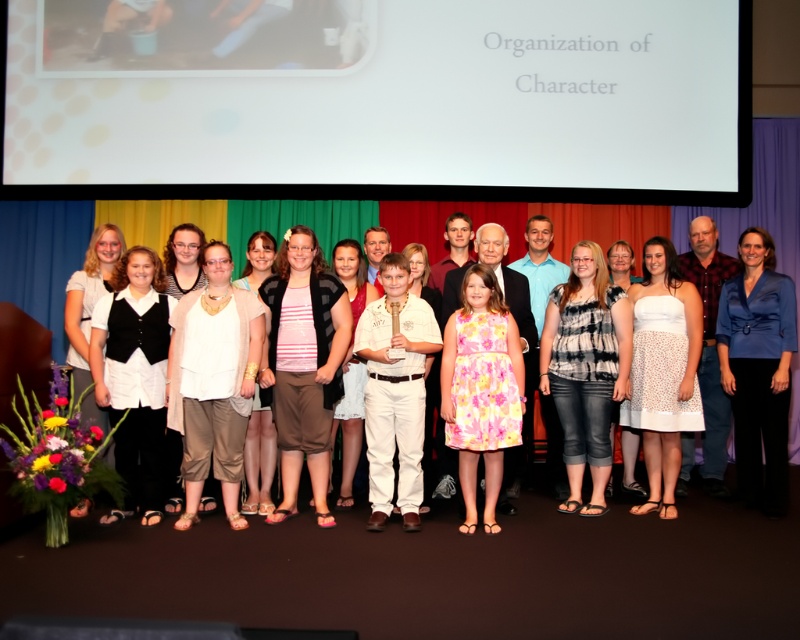
From the picture: Can you confirm if white textured blouse at center is wider than white matte dress at left?

Correct, the width of white textured blouse at center exceeds that of white matte dress at left.

Which is in front, point (224, 324) or point (84, 500)?

Point (224, 324)

Locate an element on the screen. The width and height of the screenshot is (800, 640). white textured blouse at center is located at coordinates (214, 381).

Can you confirm if white textured dress at left is bigger than blue satin blazer at center?

Incorrect, white textured dress at left is not larger than blue satin blazer at center.

Who is positioned more to the left, white textured dress at left or blue satin blazer at center?

From the viewer's perspective, white textured dress at left appears more on the left side.

Is point (620, 227) positioned in front of point (744, 289)?

No, it is not.

Where is `white textured dress at left`? Image resolution: width=800 pixels, height=640 pixels. white textured dress at left is located at coordinates (277, 221).

Describe the element at coordinates (709, 342) in the screenshot. Image resolution: width=800 pixels, height=640 pixels. I see `blue plaid shirt at right` at that location.

Does blue plaid shirt at right have a smaller size compared to white matte dress at left?

Incorrect, blue plaid shirt at right is not smaller in size than white matte dress at left.

Describe the element at coordinates (709, 342) in the screenshot. The height and width of the screenshot is (640, 800). I see `blue plaid shirt at right` at that location.

Where is `blue plaid shirt at right`? The height and width of the screenshot is (640, 800). blue plaid shirt at right is located at coordinates (709, 342).